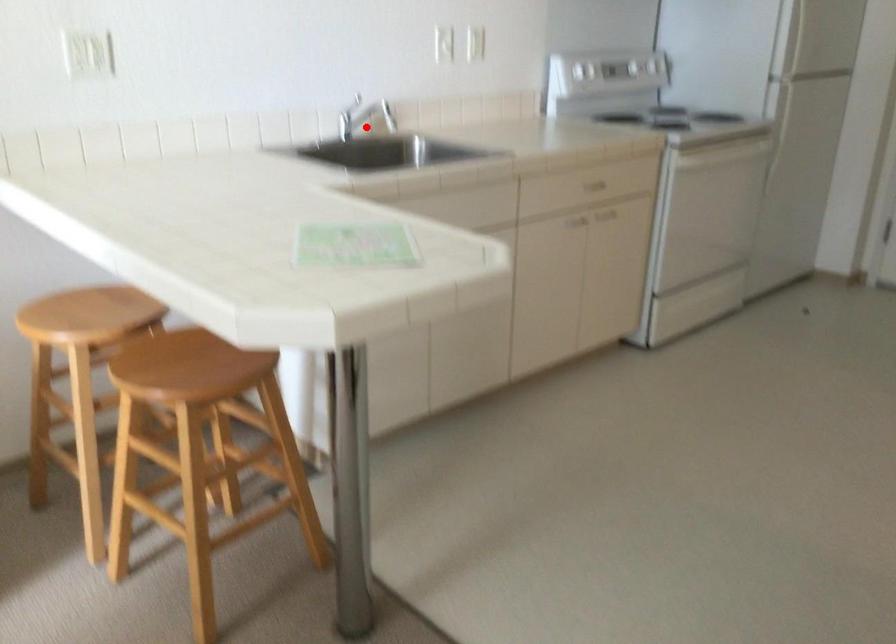
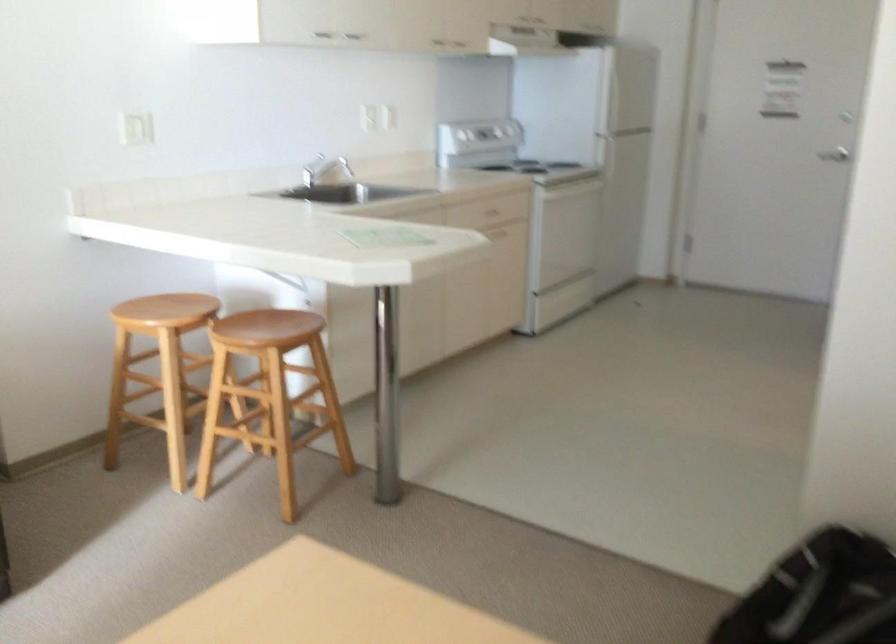
Question: I am providing you with two images of the same scene from different viewpoints. In image1, a red point is highlighted. Considering the same 3D point in image2, which of the following is correct?

Choices:
 (A) It is closer
 (B) It is farther

Answer: (B)